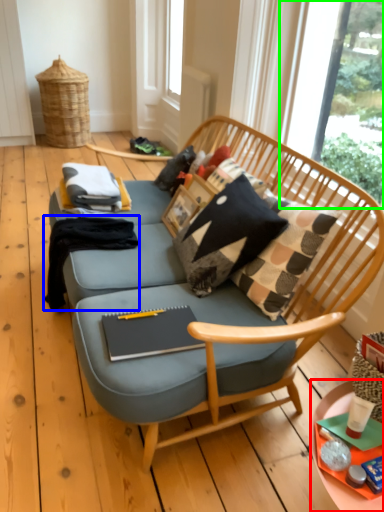
Question: Which object is the closest to the desk (highlighted by a red box)? Choose among these: clothing (highlighted by a blue box) or window screen (highlighted by a green box).

Choices:
 (A) clothing
 (B) window screen

Answer: (A)